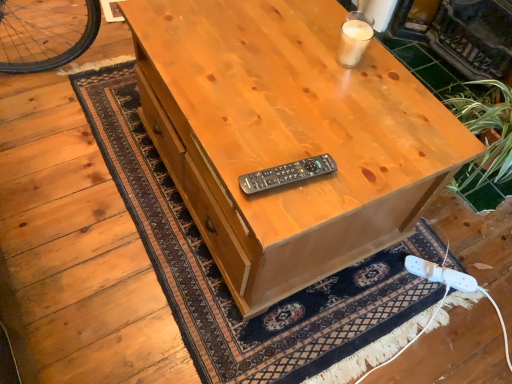
Image resolution: width=512 pixels, height=384 pixels. Identify the location of vacant space to the left of black plastic remote at center. (230, 149).